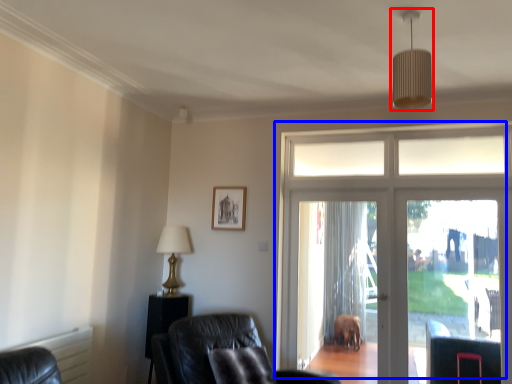
Question: Which of the following is the farthest to the observer, light fixture (highlighted by a red box) or door (highlighted by a blue box)?

Choices:
 (A) light fixture
 (B) door

Answer: (B)